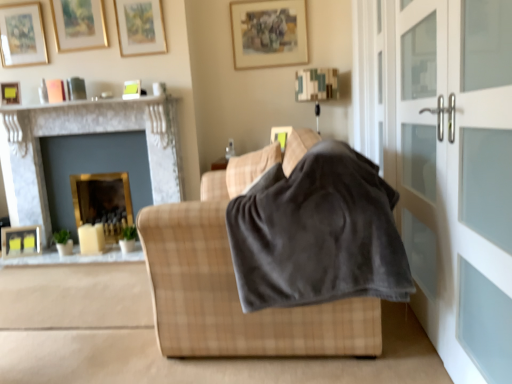
Question: Is gold-framed picture at upper left, the 4th picture frame in the top-to-bottom sequence, not within satin white screen door at right, which is counted as the first screen door, starting from the front?

Choices:
 (A) yes
 (B) no

Answer: (A)

Question: From the image's perspective, is gold-framed picture at upper left, the 4th picture frame in the top-to-bottom sequence, under satin white screen door at right, which appears as the second screen door when viewed from the back?

Choices:
 (A) no
 (B) yes

Answer: (A)

Question: Is gold-framed picture at upper left, the 4th picture frame in the top-to-bottom sequence, surrounding satin white screen door at right, which is counted as the first screen door, starting from the front?

Choices:
 (A) yes
 (B) no

Answer: (B)

Question: Is gold-framed picture at upper left, the 6th picture frame positioned from the right, oriented away from satin white screen door at right, which appears as the second screen door when viewed from the back?

Choices:
 (A) yes
 (B) no

Answer: (B)

Question: Is gold-framed picture at upper left, which ranks as the 4th picture frame in bottom-to-top order, facing towards satin white screen door at right, which appears as the second screen door when viewed from the back?

Choices:
 (A) no
 (B) yes

Answer: (A)

Question: In terms of size, does gold-framed picture at upper left, the 4th picture frame from the left, appear bigger or smaller than matte yellow picture frame at upper left, positioned as the fifth picture frame in top-to-bottom order?

Choices:
 (A) big
 (B) small

Answer: (A)

Question: From a real-world perspective, is gold-framed picture at upper left, which appears as the second picture frame when viewed from the top, positioned above or below matte yellow picture frame at upper left, the 1th picture frame positioned from the left?

Choices:
 (A) below
 (B) above

Answer: (B)

Question: In terms of width, does gold-framed picture at upper left, which ranks as the 6th picture frame in bottom-to-top order, look wider or thinner when compared to matte yellow picture frame at upper left, the seventh picture frame when ordered from right to left?

Choices:
 (A) thin
 (B) wide

Answer: (A)

Question: Relative to matte yellow picture frame at upper left, the seventh picture frame when ordered from right to left, is gold-framed picture at upper left, the 4th picture frame from the left, in front or behind?

Choices:
 (A) front
 (B) behind

Answer: (B)

Question: Looking at their shapes, would you say matte yellow picture frame at upper left, the seventh picture frame when ordered from right to left, is wider or thinner than gold-framed picture at upper left, the 6th picture frame positioned from the right?

Choices:
 (A) thin
 (B) wide

Answer: (B)

Question: Is point (9, 92) positioned closer to the camera than point (19, 56)?

Choices:
 (A) farther
 (B) closer

Answer: (B)

Question: From the image's perspective, relative to gold-framed picture at upper left, the 4th picture frame in the top-to-bottom sequence, is matte yellow picture frame at upper left, positioned as the fifth picture frame in top-to-bottom order, above or below?

Choices:
 (A) above
 (B) below

Answer: (B)

Question: Considering their positions, is matte yellow picture frame at upper left, acting as the 3th picture frame starting from the bottom, located in front of or behind gold-framed picture at upper left, the 4th picture frame in the top-to-bottom sequence?

Choices:
 (A) behind
 (B) front

Answer: (B)

Question: Is satin white screen door at right, which is counted as the first screen door, starting from the front, inside or outside of gold-framed picture at upper left, the 2th picture frame positioned from the left?

Choices:
 (A) outside
 (B) inside

Answer: (A)

Question: Considering the positions of satin white screen door at right, which appears as the second screen door when viewed from the back, and gold-framed picture at upper left, which ranks as the 4th picture frame in bottom-to-top order, in the image, is satin white screen door at right, which appears as the second screen door when viewed from the back, bigger or smaller than gold-framed picture at upper left, which ranks as the 4th picture frame in bottom-to-top order,?

Choices:
 (A) small
 (B) big

Answer: (B)